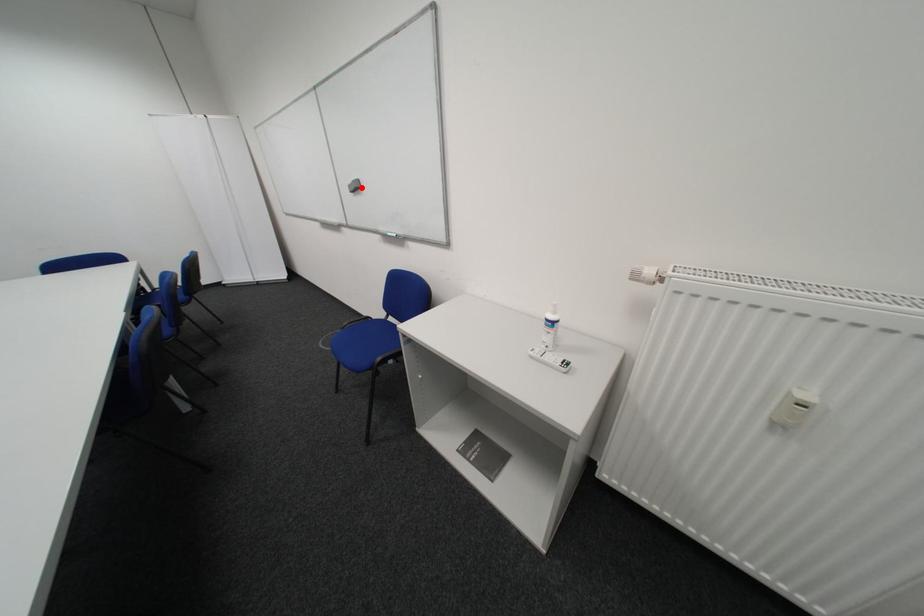
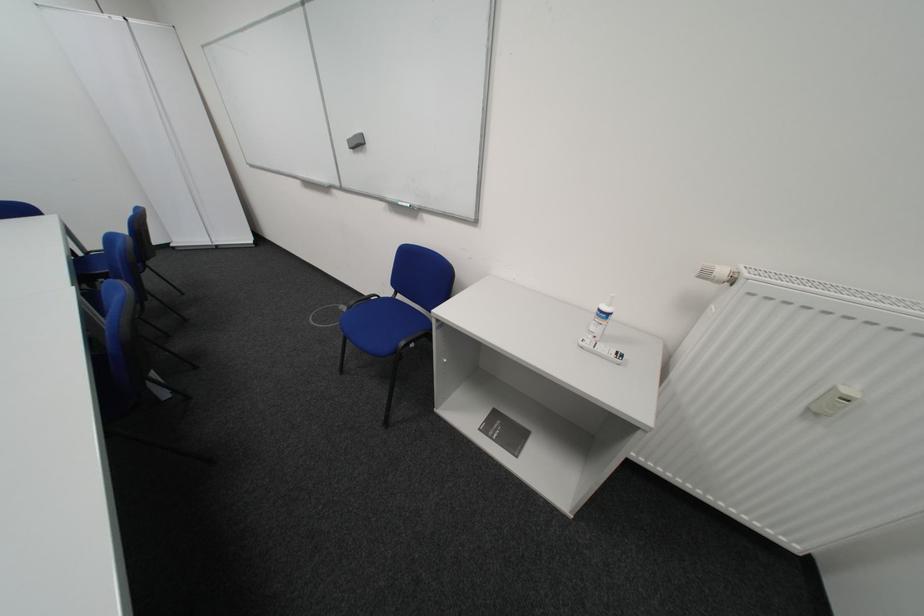
Find the pixel in the second image that matches the highlighted location in the first image.

(361, 143)